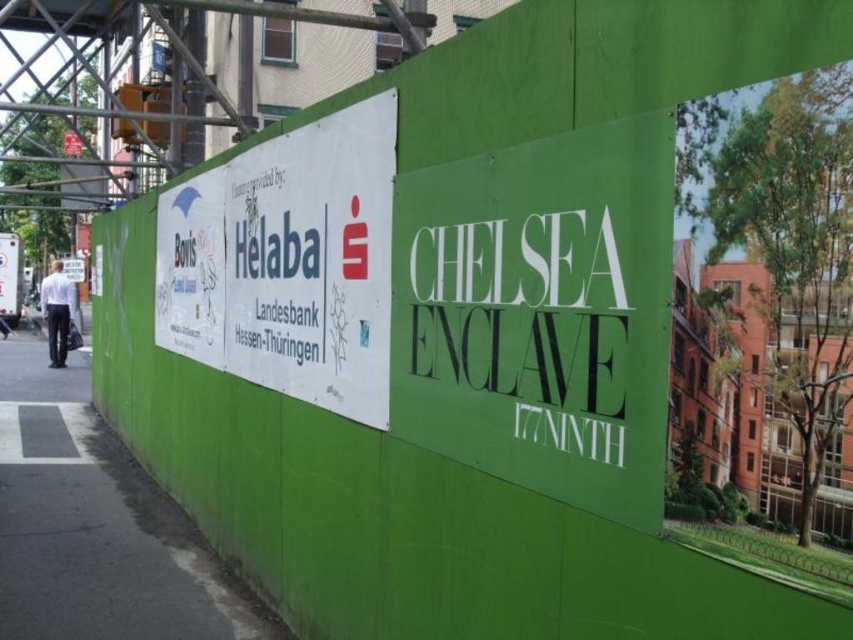
Question: Does green matte sign at center appear over green asphalt pavement at lower left?

Choices:
 (A) no
 (B) yes

Answer: (B)

Question: Which object is the closest to the green asphalt pavement at lower left?

Choices:
 (A) green matte sign at center
 (B) white paper sign at center

Answer: (B)

Question: Can you confirm if green matte sign at center is positioned below white paper sign at center?

Choices:
 (A) no
 (B) yes

Answer: (B)

Question: Which of the following is the farthest from the observer?

Choices:
 (A) white paper sign at center
 (B) green asphalt pavement at lower left
 (C) green matte sign at center

Answer: (B)

Question: Can you confirm if green matte sign at center is wider than white paper sign at center?

Choices:
 (A) no
 (B) yes

Answer: (A)

Question: Which of the following is the farthest from the observer?

Choices:
 (A) (202, 348)
 (B) (6, 564)
 (C) (554, 435)

Answer: (A)